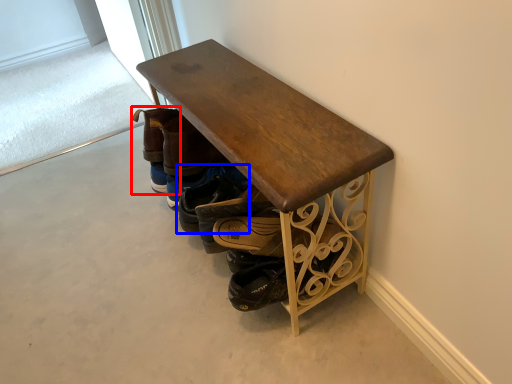
Question: Among these objects, which one is farthest to the camera, footwear (highlighted by a red box) or footwear (highlighted by a blue box)?

Choices:
 (A) footwear
 (B) footwear

Answer: (A)